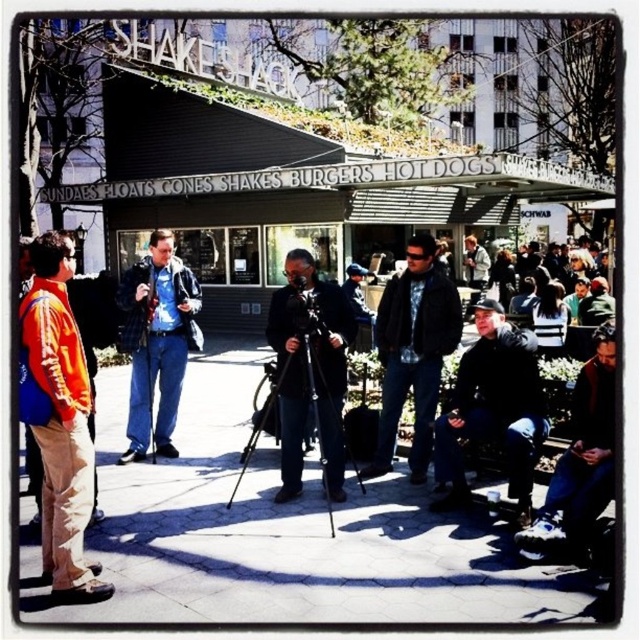
You are a photographer trying to capture the Shake Shack sign clearly. You have a black plastic video camera at center and dark blue jeans at lower right in your frame. Which object should you adjust to ensure the Shake Shack sign is fully visible?

The dark blue jeans at lower right is larger in size than the black plastic video camera at center, so you should adjust the dark blue jeans at lower right to ensure the Shake Shack sign is fully visible.